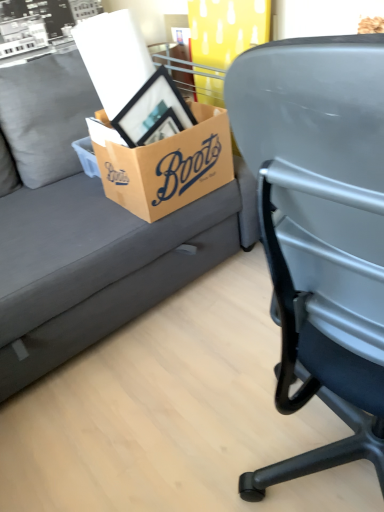
Consider the image. What is the approximate height of matte gray couch at upper left?

matte gray couch at upper left is 35.64 inches in height.

At what (x,y) coordinates should I click in order to perform the action: click on matte gray couch at upper left. Please return your answer as a coordinate pair (x, y). The width and height of the screenshot is (384, 512). Looking at the image, I should click on (99, 265).

The image size is (384, 512). Describe the element at coordinates (99, 265) in the screenshot. I see `matte gray couch at upper left` at that location.

This screenshot has width=384, height=512. What do you see at coordinates (168, 166) in the screenshot?
I see `brown cardboard box at center` at bounding box center [168, 166].

Identify the location of brown cardboard box at center. This screenshot has width=384, height=512. (168, 166).

Where is `matte gray couch at upper left`? The image size is (384, 512). matte gray couch at upper left is located at coordinates (99, 265).

Visually, is matte gray couch at upper left positioned to the left or to the right of brown cardboard box at center?

Based on their positions, matte gray couch at upper left is located to the left of brown cardboard box at center.

Considering their positions, is matte gray couch at upper left located in front of or behind brown cardboard box at center?

matte gray couch at upper left is in front of brown cardboard box at center.

Between point (180, 236) and point (150, 216), which one is positioned in front?

The point (150, 216) is closer.

From the image's perspective, is matte gray couch at upper left on brown cardboard box at center?

Actually, matte gray couch at upper left appears below brown cardboard box at center in the image.

From a real-world perspective, is matte gray couch at upper left above or below brown cardboard box at center?

Clearly, from a real-world perspective, matte gray couch at upper left is below brown cardboard box at center.

Is matte gray couch at upper left wider than brown cardboard box at center?

Indeed, matte gray couch at upper left has a greater width compared to brown cardboard box at center.

Can you confirm if matte gray couch at upper left is shorter than brown cardboard box at center?

Incorrect, the height of matte gray couch at upper left does not fall short of that of brown cardboard box at center.

Does matte gray couch at upper left have a smaller size compared to brown cardboard box at center?

Actually, matte gray couch at upper left might be larger than brown cardboard box at center.

Looking at this image, is matte gray couch at upper left surrounding brown cardboard box at center?

Yes, matte gray couch at upper left contains brown cardboard box at center.

Would you say matte gray couch at upper left is a long distance from brown cardboard box at center?

Actually, matte gray couch at upper left and brown cardboard box at center are a little close together.

Looking at this image, could you tell me if matte gray couch at upper left is facing brown cardboard box at center?

Yes, matte gray couch at upper left is turned towards brown cardboard box at center.

Identify the location of box that is above the matte gray couch at upper left (from the image's perspective). (168, 166).

Does brown cardboard box at center appear on the right side of matte gray couch at upper left?

Yes, brown cardboard box at center is to the right of matte gray couch at upper left.

Is brown cardboard box at center in front of or behind matte gray couch at upper left in the image?

Visually, brown cardboard box at center is located behind matte gray couch at upper left.

Which is behind, point (108, 194) or point (177, 217)?

The point (108, 194) is farther.

From the image's perspective, which one is positioned lower, brown cardboard box at center or matte gray couch at upper left?

From the image's view, matte gray couch at upper left is below.

From a real-world perspective, is brown cardboard box at center positioned over matte gray couch at upper left based on gravity?

Yes.

In terms of width, does brown cardboard box at center look wider or thinner when compared to matte gray couch at upper left?

In the image, brown cardboard box at center appears to be more narrow than matte gray couch at upper left.

Considering the relative sizes of brown cardboard box at center and matte gray couch at upper left in the image provided, is brown cardboard box at center taller than matte gray couch at upper left?

Incorrect, the height of brown cardboard box at center is not larger of that of matte gray couch at upper left.

Considering the sizes of brown cardboard box at center and matte gray couch at upper left in the image, is brown cardboard box at center bigger or smaller than matte gray couch at upper left?

In the image, brown cardboard box at center appears to be smaller than matte gray couch at upper left.

Can we say brown cardboard box at center lies outside matte gray couch at upper left?

No, brown cardboard box at center is not entirely external to matte gray couch at upper left.

Are brown cardboard box at center and matte gray couch at upper left located far from each other?

brown cardboard box at center is near matte gray couch at upper left, not far away.

Is brown cardboard box at center oriented away from matte gray couch at upper left?

Yes, brown cardboard box at center is facing away from matte gray couch at upper left.

How different are the orientations of brown cardboard box at center and matte gray couch at upper left in degrees?

The angular difference between brown cardboard box at center and matte gray couch at upper left is 0.762 degrees.

This screenshot has height=512, width=384. Find the location of `box on the right of matte gray couch at upper left`. box on the right of matte gray couch at upper left is located at coordinates (168, 166).

Identify the location of box behind the matte gray couch at upper left. Image resolution: width=384 pixels, height=512 pixels. (168, 166).

Image resolution: width=384 pixels, height=512 pixels. I want to click on studio couch below the brown cardboard box at center (from the image's perspective), so click(x=99, y=265).